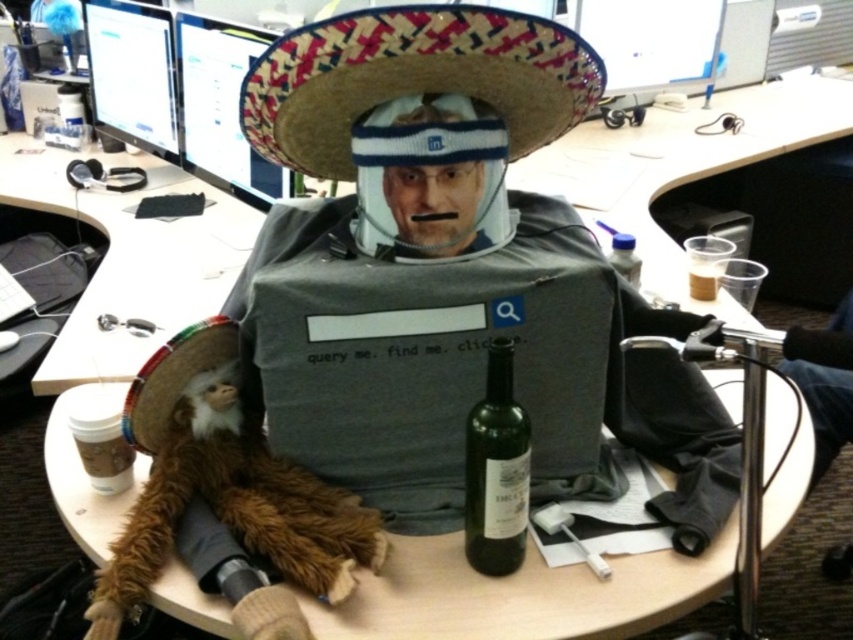
Which of these two, woven straw sombrero at center or green glass bottle at center, stands taller?

green glass bottle at center

Who is positioned more to the right, woven straw sombrero at center or green glass bottle at center?

green glass bottle at center

The height and width of the screenshot is (640, 853). Find the location of `woven straw sombrero at center`. woven straw sombrero at center is located at coordinates (419, 113).

Is point (296, 513) positioned behind point (619, 260)?

No.

Between brown plush monkey at lower left and clear plastic bottle at upper right, which one has less height?

clear plastic bottle at upper right is shorter.

Measure the distance between point (x=202, y=456) and camera.

Point (x=202, y=456) is 37.48 inches from camera.

Where is `brown plush monkey at lower left`? brown plush monkey at lower left is located at coordinates (224, 483).

Who is shorter, woven straw sombrero at center or brown plush monkey at lower left?

woven straw sombrero at center

Between point (437, 243) and point (242, 483), which one is positioned in front?

Point (437, 243)

The width and height of the screenshot is (853, 640). Identify the location of woven straw sombrero at center. (419, 113).